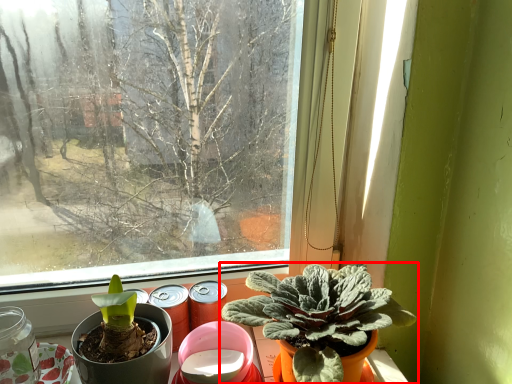
Question: Considering the relative positions of houseplant (annotated by the red box) and glass jar in the image provided, where is houseplant (annotated by the red box) located with respect to the staircase?

Choices:
 (A) left
 (B) right

Answer: (B)